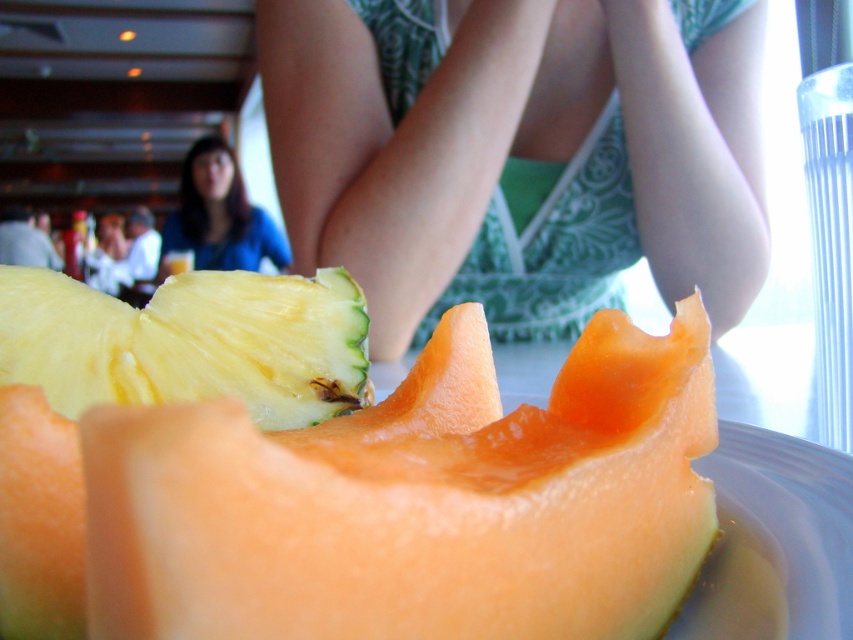
Question: Which point is farther to the camera?

Choices:
 (A) (682, 113)
 (B) (186, 570)

Answer: (A)

Question: Can you confirm if orange fleshed cantaloupe at center is smaller than blue fabric shirt at upper left?

Choices:
 (A) yes
 (B) no

Answer: (A)

Question: Is orange fleshed cantaloupe at center wider than yellow/green textured pineapple at center?

Choices:
 (A) no
 (B) yes

Answer: (B)

Question: Which of these objects is positioned closest to the blue fabric shirt at upper left?

Choices:
 (A) yellow/green textured pineapple at center
 (B) green printed fabric at center

Answer: (B)

Question: Does green printed fabric at center have a greater width compared to blue fabric shirt at upper left?

Choices:
 (A) no
 (B) yes

Answer: (B)

Question: Which of the following is the closest to the observer?

Choices:
 (A) yellow/green textured pineapple at center
 (B) blue fabric shirt at upper left
 (C) orange fleshed cantaloupe at center

Answer: (C)